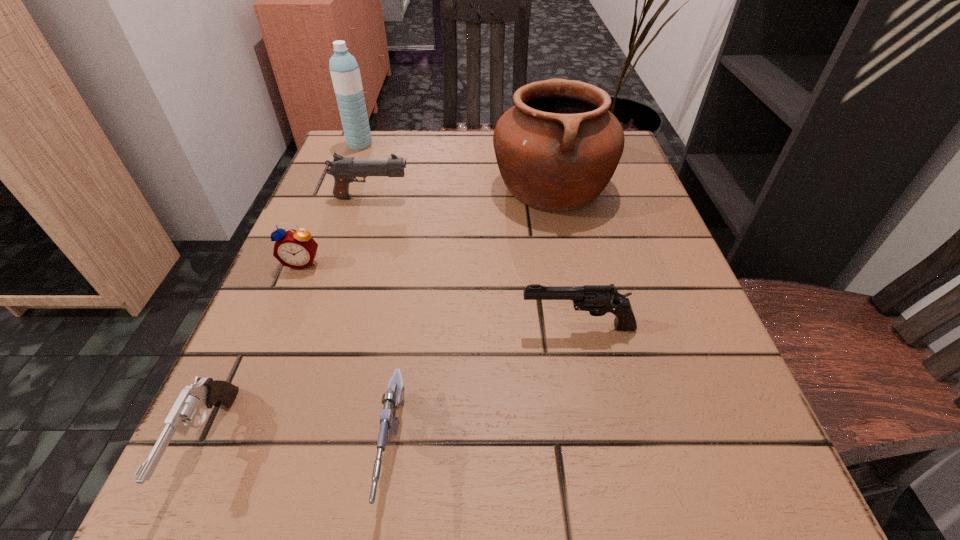
Identify the location of blank space located on the front of the pottery. This screenshot has height=540, width=960. (582, 334).

Locate an element on the screen. The height and width of the screenshot is (540, 960). vacant space located 0.300m in the direction the farthest gun is aimed is located at coordinates (554, 198).

Image resolution: width=960 pixels, height=540 pixels. I want to click on free space located at the end of the barrel of the rightmost gun, so click(x=448, y=327).

At what (x,y) coordinates should I click in order to perform the action: click on free space located 0.080m at the end of the barrel of the rightmost gun. Please return your answer as a coordinate pair (x, y). The width and height of the screenshot is (960, 540). Looking at the image, I should click on (468, 327).

The width and height of the screenshot is (960, 540). Identify the location of vacant space located 0.070m at the end of the barrel of the rightmost gun. pos(475,327).

This screenshot has height=540, width=960. I want to click on free spot located 0.250m on the front-facing side of the fourth nearest object, so click(245, 401).

This screenshot has height=540, width=960. Find the location of `water bottle located at the far edge`. water bottle located at the far edge is located at coordinates (345, 73).

Find the location of a particular element. Image resolution: width=960 pixels, height=540 pixels. pottery at the far edge is located at coordinates (557, 149).

Find the location of `water bottle present at the left edge`. water bottle present at the left edge is located at coordinates (345, 73).

I want to click on alarm clock present at the left edge, so click(296, 249).